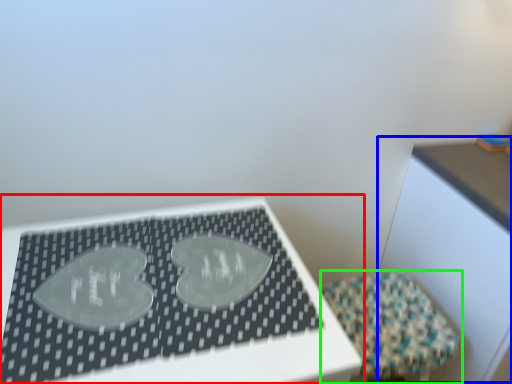
Question: Based on their relative distances, which object is farther from table (highlighted by a red box)? Choose from table (highlighted by a blue box) and furniture (highlighted by a green box).

Choices:
 (A) table
 (B) furniture

Answer: (A)